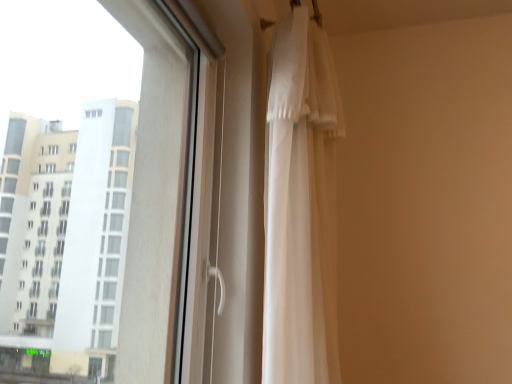
This screenshot has width=512, height=384. Describe the element at coordinates (301, 206) in the screenshot. I see `white sheer curtain at right` at that location.

Identify the location of white sheer curtain at right. (301, 206).

What is the approximate width of transparent glass window at upper left?

The width of transparent glass window at upper left is 20.07 centimeters.

Where is `transparent glass window at upper left`? The height and width of the screenshot is (384, 512). transparent glass window at upper left is located at coordinates (110, 223).

Describe the element at coordinates (110, 223) in the screenshot. I see `transparent glass window at upper left` at that location.

This screenshot has height=384, width=512. Identify the location of white sheer curtain at right. (301, 206).

Visually, is white sheer curtain at right positioned to the left or to the right of transparent glass window at upper left?

white sheer curtain at right is positioned on transparent glass window at upper left's right side.

Which object is further away from the camera, white sheer curtain at right or transparent glass window at upper left?

white sheer curtain at right is further from the camera.

Which is in front, point (320, 36) or point (14, 243)?

The point (320, 36) is in front.

From the image's perspective, is white sheer curtain at right located beneath transparent glass window at upper left?

Correct, white sheer curtain at right appears lower than transparent glass window at upper left in the image.

From a real-world perspective, between white sheer curtain at right and transparent glass window at upper left, who is vertically lower?

transparent glass window at upper left, from a real-world perspective.

Can you confirm if white sheer curtain at right is wider than transparent glass window at upper left?

Incorrect, the width of white sheer curtain at right does not surpass that of transparent glass window at upper left.

Who is taller, white sheer curtain at right or transparent glass window at upper left?

With more height is white sheer curtain at right.

Considering the relative sizes of white sheer curtain at right and transparent glass window at upper left in the image provided, is white sheer curtain at right smaller than transparent glass window at upper left?

Indeed, white sheer curtain at right has a smaller size compared to transparent glass window at upper left.

Is white sheer curtain at right completely or partially outside of transparent glass window at upper left?

white sheer curtain at right lies outside transparent glass window at upper left's area.

Is white sheer curtain at right in contact with transparent glass window at upper left?

No, white sheer curtain at right is not beside transparent glass window at upper left.

Is white sheer curtain at right turned away from transparent glass window at upper left?

That's not correct — white sheer curtain at right is not looking away from transparent glass window at upper left.

Can you tell me how much white sheer curtain at right and transparent glass window at upper left differ in facing direction?

They differ by 0.58 degrees in their facing directions.

At what (x,y) coordinates should I click in order to perform the action: click on curtain below the transparent glass window at upper left (from the image's perspective). Please return your answer as a coordinate pair (x, y). Looking at the image, I should click on (301, 206).

Is transparent glass window at upper left at the left side of white sheer curtain at right?

Indeed, transparent glass window at upper left is positioned on the left side of white sheer curtain at right.

Is transparent glass window at upper left positioned in front of white sheer curtain at right?

That is True.

Is point (15, 361) positioned in front of point (272, 68)?

No, it is behind (272, 68).

From the image's perspective, would you say transparent glass window at upper left is positioned over white sheer curtain at right?

Yes.

From a real-world perspective, who is located higher, transparent glass window at upper left or white sheer curtain at right?

white sheer curtain at right.

In the scene shown: Between transparent glass window at upper left and white sheer curtain at right, which one has smaller width?

white sheer curtain at right is thinner.

Which of these two, transparent glass window at upper left or white sheer curtain at right, stands taller?

white sheer curtain at right.

Is transparent glass window at upper left bigger than white sheer curtain at right?

Yes.

Is transparent glass window at upper left spatially inside white sheer curtain at right, or outside of it?

transparent glass window at upper left is not inside white sheer curtain at right, it's outside.

Can you see transparent glass window at upper left touching white sheer curtain at right?

No, transparent glass window at upper left is not next to white sheer curtain at right.

Is transparent glass window at upper left aimed at white sheer curtain at right?

Yes.

Looking at this image, how many degrees apart are the facing directions of transparent glass window at upper left and white sheer curtain at right?

The facing directions of transparent glass window at upper left and white sheer curtain at right are 0.58 degrees apart.

You are a GUI agent. You are given a task and a screenshot of the screen. Output one action in this format:
    pyautogui.click(x=<x>, y=<y>)
    Task: Click on the window located underneath the white sheer curtain at right (from a real-world perspective)
    
    Given the screenshot: What is the action you would take?
    pyautogui.click(x=110, y=223)

Locate an element on the screen. This screenshot has width=512, height=384. curtain above the transparent glass window at upper left (from a real-world perspective) is located at coordinates (301, 206).

Locate an element on the screen. curtain that is on the right side of transparent glass window at upper left is located at coordinates (301, 206).